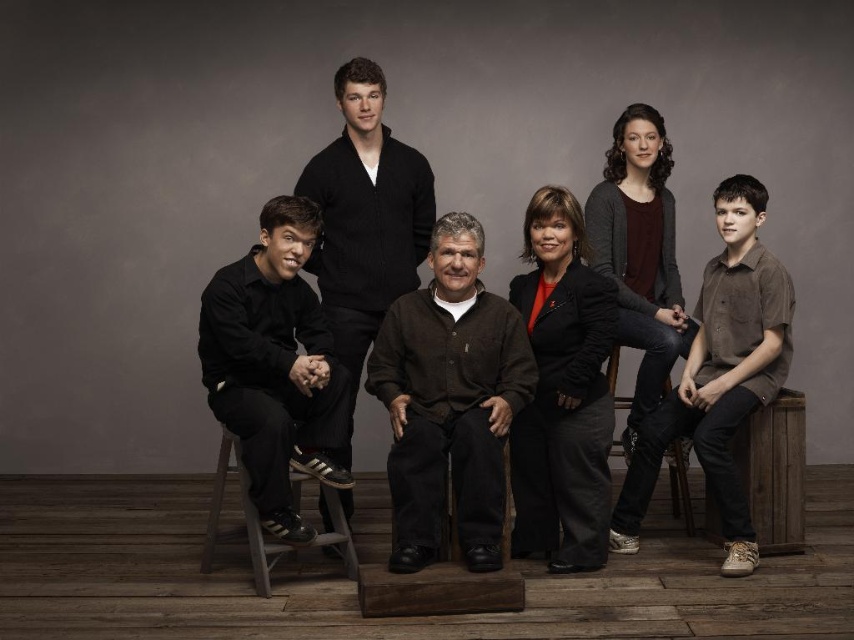
Consider the image. You are a photographer setting up for a group photo. You need to ensure that the black matte shirt at left and the wooden chair at lower right are both visible in the frame. Based on their sizes, which object should you prioritize keeping within the camera frame?

The black matte shirt at left occupies less space than the wooden chair at lower right, so you should prioritize keeping the wooden chair at lower right within the camera frame since it takes up more space and might be more likely to be cropped out if not properly positioned.

You are organizing a photoshoot and need to ensure that all items fit into a storage box. The storage box can only accommodate items smaller than the wooden chair at center. Based on the scene description, will the black matte shirt at left fit inside the box?

The black matte shirt at left is larger in size than the wooden chair at center. Since the storage box can only hold items smaller than the wooden chair at center, the black matte shirt at left will not fit inside the box.

You are trying to find the black matte shirt at left in the group photo. According to the scene, where is it located relative to the wooden chair at center?

The black matte shirt at left is positioned on the left side of the wooden chair at center.